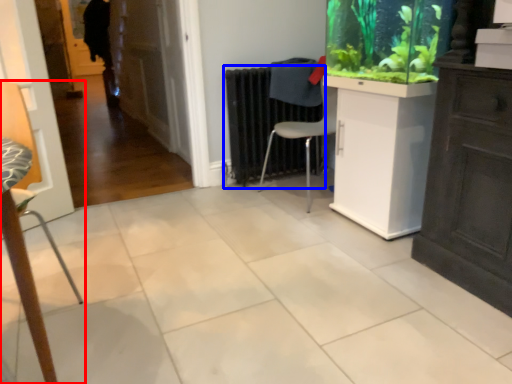
Question: Among these objects, which one is farthest to the camera, chair (highlighted by a red box) or radiator (highlighted by a blue box)?

Choices:
 (A) chair
 (B) radiator

Answer: (B)